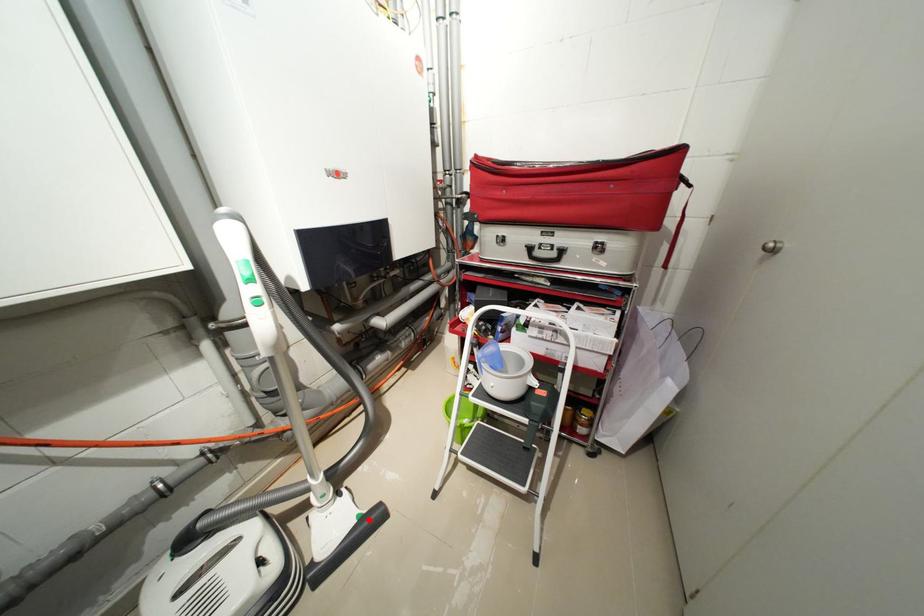
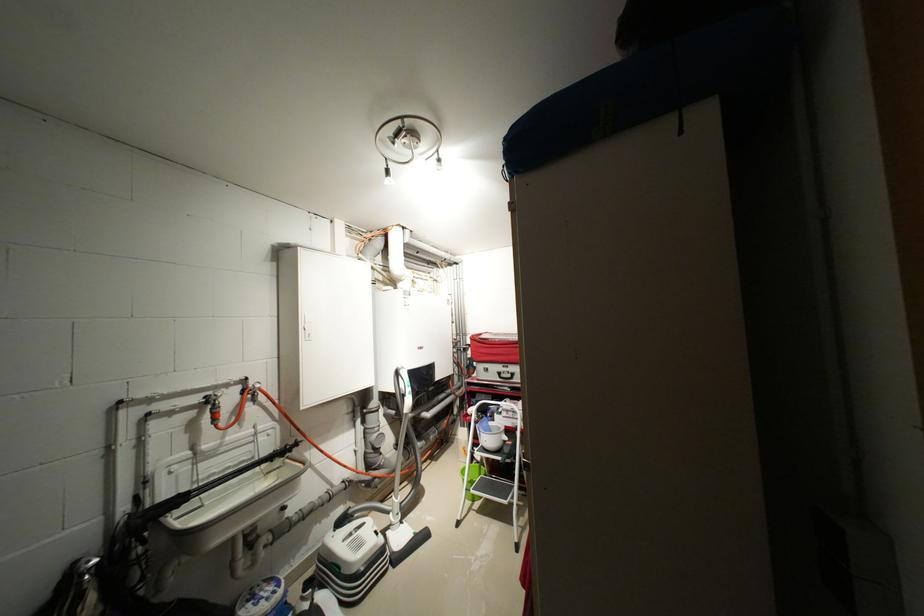
Question: I am providing you with two images of the same scene from different viewpoints. A red point is marked on the first image. At the location where the point appears in image 1, is it still visible in image 2?

Choices:
 (A) Yes
 (B) No

Answer: (A)